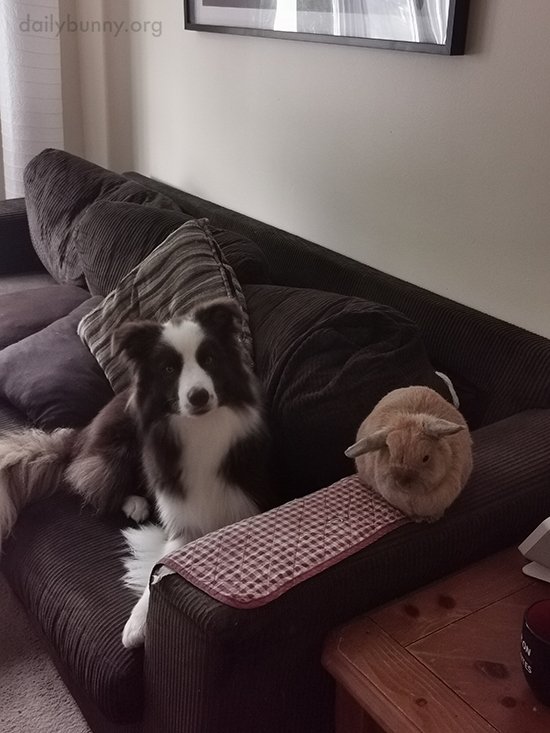
This screenshot has height=733, width=550. What are the coordinates of `side table` in the screenshot? It's located at (407, 688).